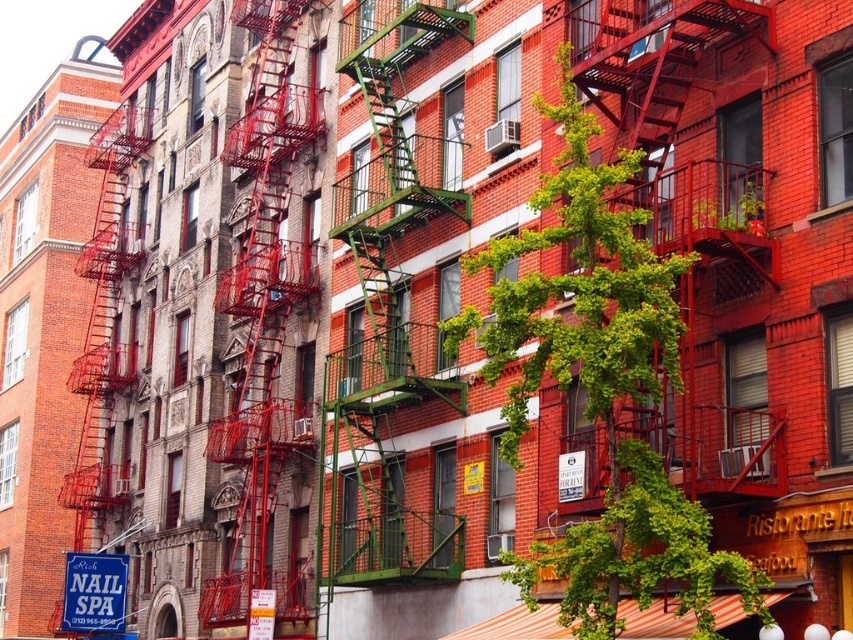
Who is taller, green metal fire escape at center or metallic red fire escape at left?

metallic red fire escape at left is taller.

Who is more forward, (381, 566) or (239, 538)?

Point (381, 566) is more forward.

Who is more distant from viewer, (363, 467) or (241, 380)?

The point (241, 380) is behind.

Identify the location of green metal fire escape at center. (387, 307).

Can you confirm if green metal fire escape at center is wider than blue plastic sign at lower left?

Yes.

Where is `green metal fire escape at center`? Image resolution: width=853 pixels, height=640 pixels. green metal fire escape at center is located at coordinates (387, 307).

Can you confirm if metallic red fire escape at left is positioned below blue plastic sign at lower left?

Answer: No.

From the picture: Which is more to the right, metallic red fire escape at left or blue plastic sign at lower left?

metallic red fire escape at left

You are a GUI agent. You are given a task and a screenshot of the screen. Output one action in this format:
    pyautogui.click(x=<x>, y=<y>)
    Task: Click on the metallic red fire escape at left
    The width and height of the screenshot is (853, 640).
    Given the screenshot: What is the action you would take?
    pyautogui.click(x=263, y=321)

You are a GUI agent. You are given a task and a screenshot of the screen. Output one action in this format:
    pyautogui.click(x=<x>, y=<y>)
    Task: Click on the metallic red fire escape at left
    This screenshot has width=853, height=640.
    Given the screenshot: What is the action you would take?
    pyautogui.click(x=263, y=321)